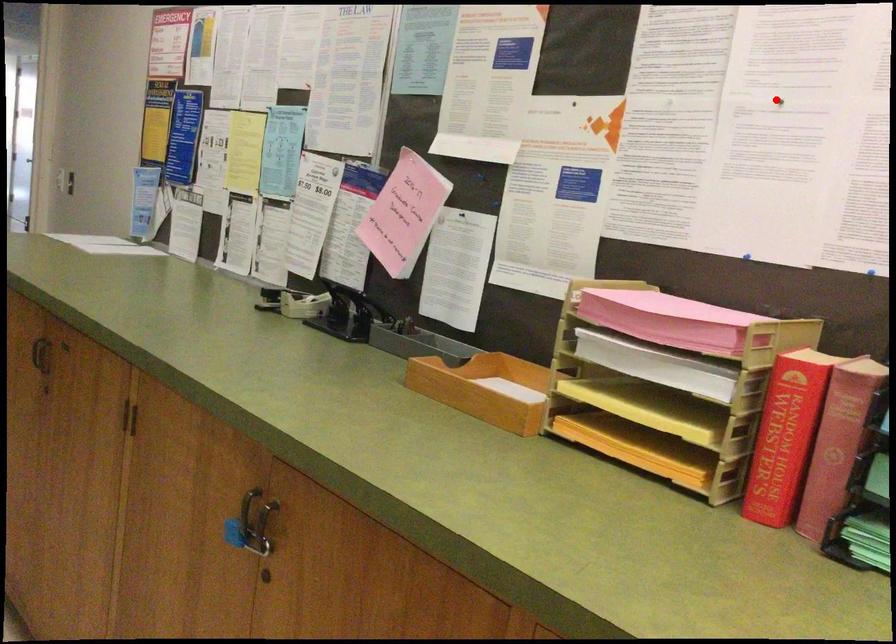
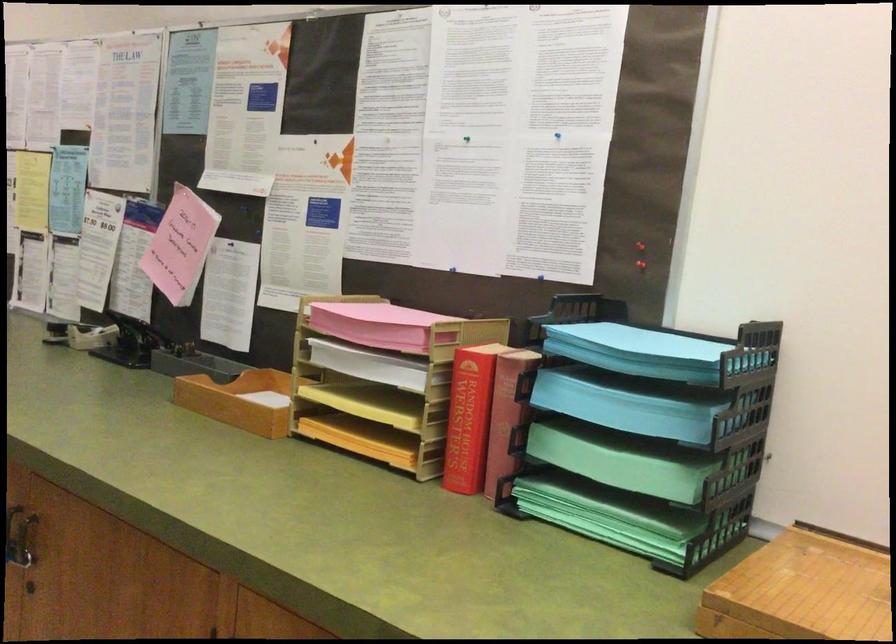
Question: I am providing you with two images of the same scene from different viewpoints. In image1, a red point is highlighted. Considering the same 3D point in image2, which of the following is correct?

Choices:
 (A) It is closer
 (B) It is farther

Answer: (B)